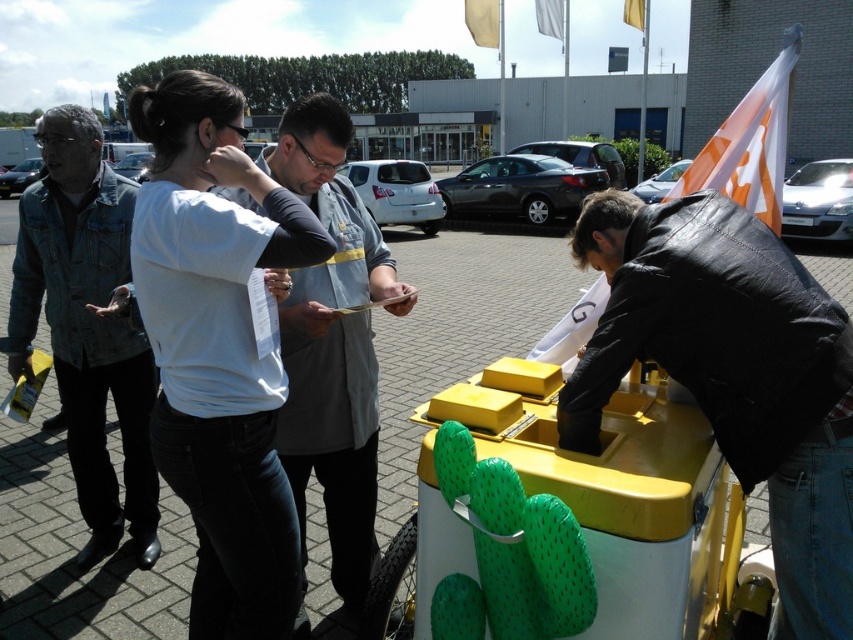
Describe the element at coordinates (86, 324) in the screenshot. I see `denim jacket at left` at that location.

Image resolution: width=853 pixels, height=640 pixels. Find the location of `denim jacket at left`. denim jacket at left is located at coordinates (86, 324).

Between point (772, 252) and point (321, 368), which one is positioned in front?

Positioned in front is point (772, 252).

Between yellow plastic street vendor at right and white shirt at center, which one appears on the left side from the viewer's perspective?

From the viewer's perspective, white shirt at center appears more on the left side.

Who is more distant from viewer, (840, 513) or (297, 625)?

Positioned behind is point (297, 625).

You are a GUI agent. You are given a task and a screenshot of the screen. Output one action in this format:
    pyautogui.click(x=<x>, y=<y>)
    Task: Click on the yellow plastic street vendor at right
    This screenshot has height=640, width=853.
    Given the screenshot: What is the action you would take?
    pyautogui.click(x=732, y=372)

Does yellow plastic street vendor at right appear under denim jacket at left?

No, yellow plastic street vendor at right is not below denim jacket at left.

Between yellow plastic street vendor at right and denim jacket at left, which one is positioned lower?

denim jacket at left is lower down.

Find the location of a particular element. This screenshot has width=853, height=640. yellow plastic street vendor at right is located at coordinates (732, 372).